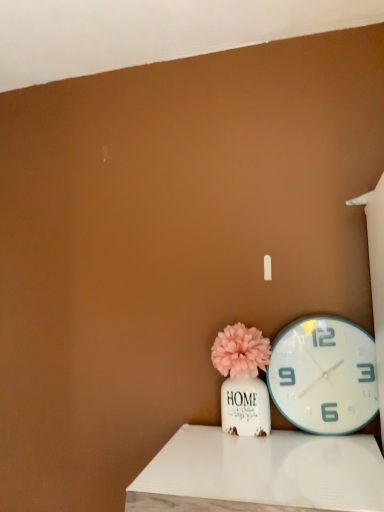
Locate an element on the screen. Image resolution: width=384 pixels, height=512 pixels. empty space that is ontop of white wood table at lower center (from a real-world perspective) is located at coordinates click(264, 459).